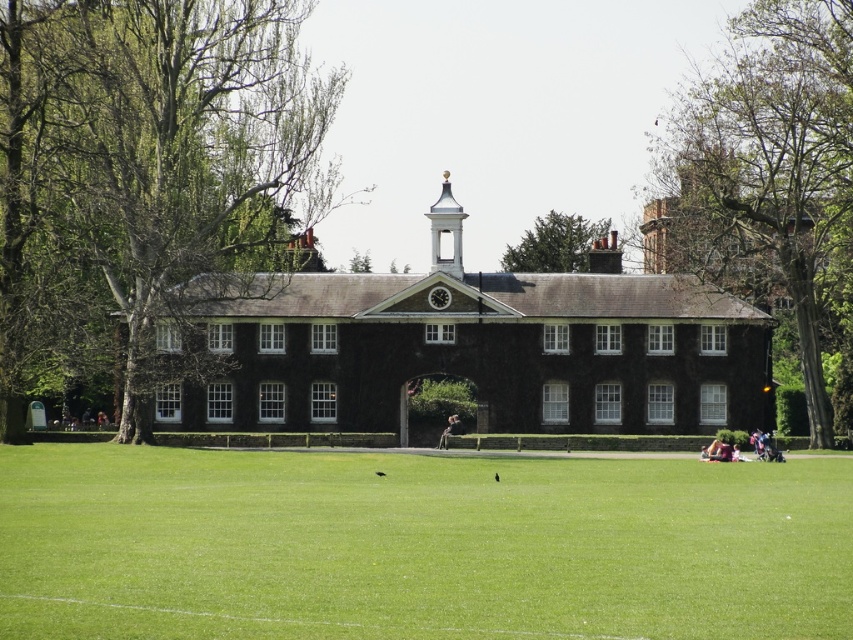
You are standing in front of the building and want to take a photo that includes both the green leafy tree at center and the green leafy tree at right. Which tree should you position closer to the building to ensure both are fully visible in the frame?

The green leafy tree at center is larger in size than the green leafy tree at right, so you should position the green leafy tree at right closer to the building to ensure both are fully visible in the frame.